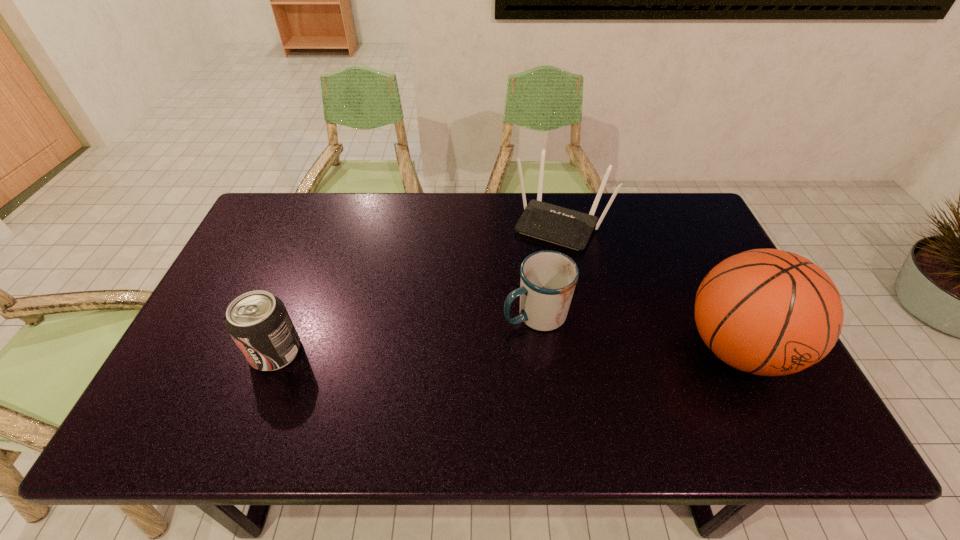
At what (x,y) coordinates should I click in order to perform the action: click on free space on the desktop that is between the soda can and the rightmost object and is positioned on the front-facing side of the farthest object. Please return your answer as a coordinate pair (x, y). Looking at the image, I should click on (491, 350).

Image resolution: width=960 pixels, height=540 pixels. I want to click on free space on the desktop that is between the soda can and the rightmost object and is positioned on the handle side of the mug, so click(x=472, y=350).